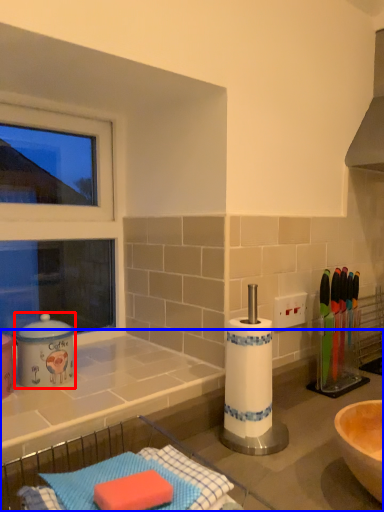
Question: Which of the following is the closest to the observer, appliance (highlighted by a red box) or countertop (highlighted by a blue box)?

Choices:
 (A) appliance
 (B) countertop

Answer: (B)